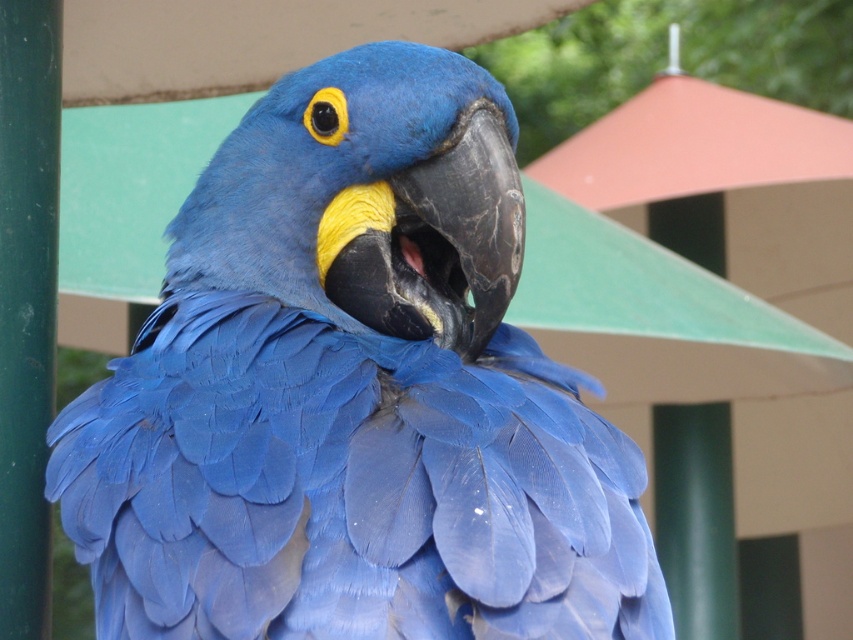
You are a birdwatcher observing the matte blue parrot at center and the green matte pole at left. Which object is closer to you?

The matte blue parrot at center is closer to you because it is in front of the green matte pole at left.

You are a birdwatcher trying to determine the relative sizes of two objects in the scene. You see the matte blue parrot at center and the green matte pole at left. Which object is larger?

The matte blue parrot at center is bigger than the green matte pole at left according to the description.

You are a birdwatcher observing the matte blue parrot at center and the green matte pole at left in the scene. Which object is shorter?

The matte blue parrot at center is shorter than the green matte pole at left.